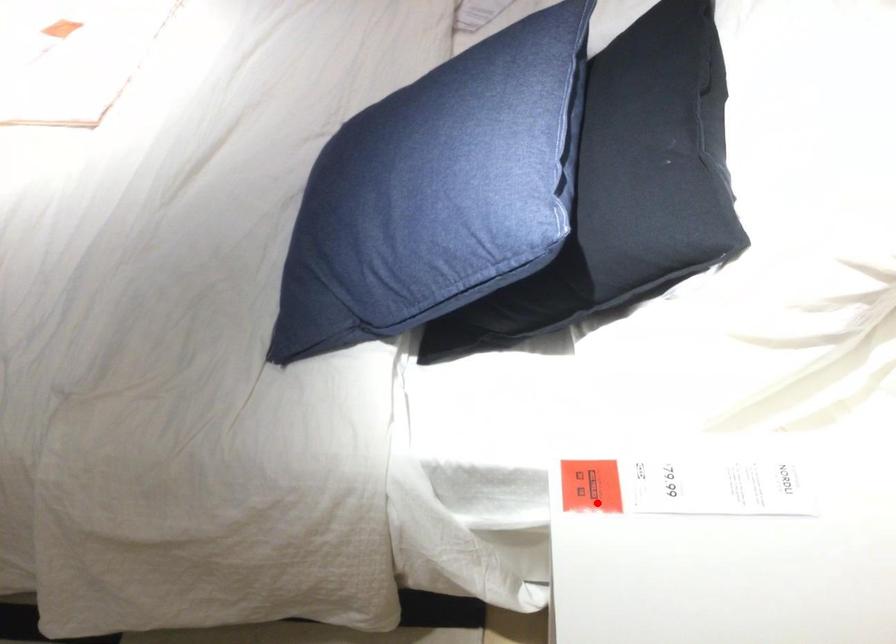
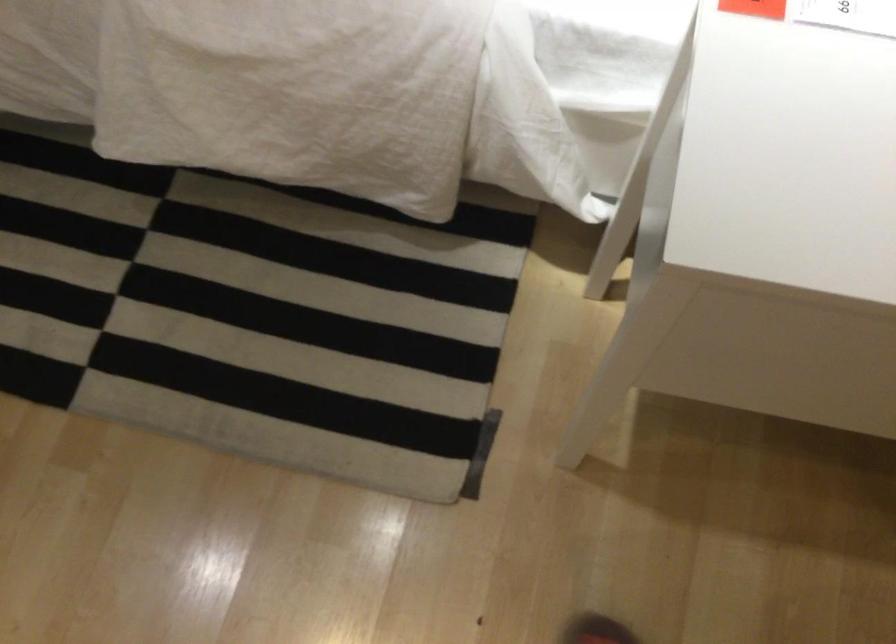
In the second image, find the point that corresponds to the highlighted location in the first image.

(754, 8)